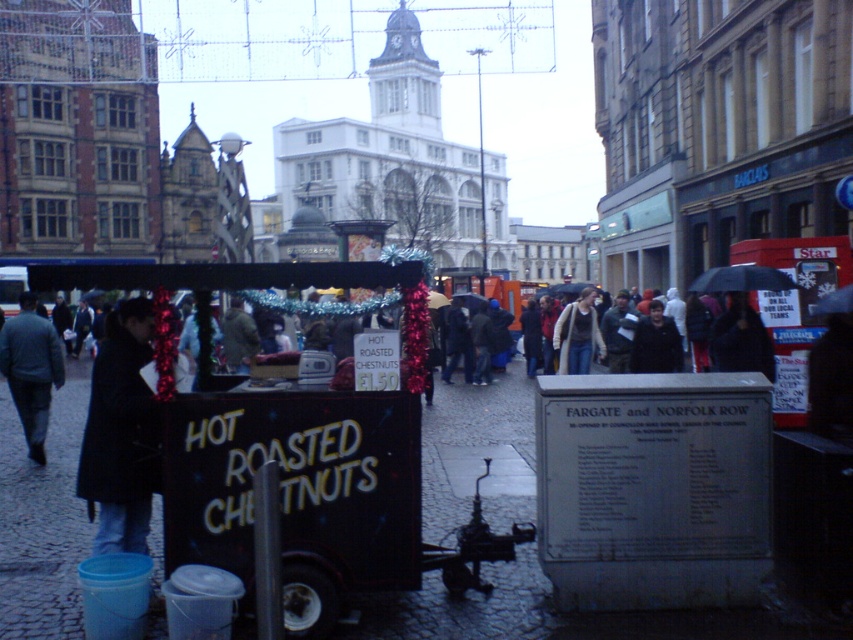
You are a photographer standing in front of the mobile food stall with festive decorations. You notice two jackets hanging on the stall, the dark gray jacket at left and the denim jacket at center. Which jacket appears taller from your viewpoint?

The dark gray jacket at left appears taller than the denim jacket at center from your viewpoint.

You are a tourist standing at the food stall and want to take a photo of both the dark gray jacket at left and the denim jacket at center. The camera you have can focus on objects within a 10 meter range. Can you capture both jackets in one photo without moving?

The dark gray jacket at left is 8.53 meters away from the denim jacket at center. Since the distance between them is within the camera focus range of 10 meters, you can capture both jackets in one photo without moving.

You are a street performer preparing to set up your equipment in the bustling urban scene. You see a dark gray jacket at left and a denim jacket at center. Which jacket should you avoid placing your equipment on to ensure it doesn

The dark gray jacket at left has a larger size compared to denim jacket at center, so you should avoid placing your equipment on the dark gray jacket at left as it is bigger and might require more space.